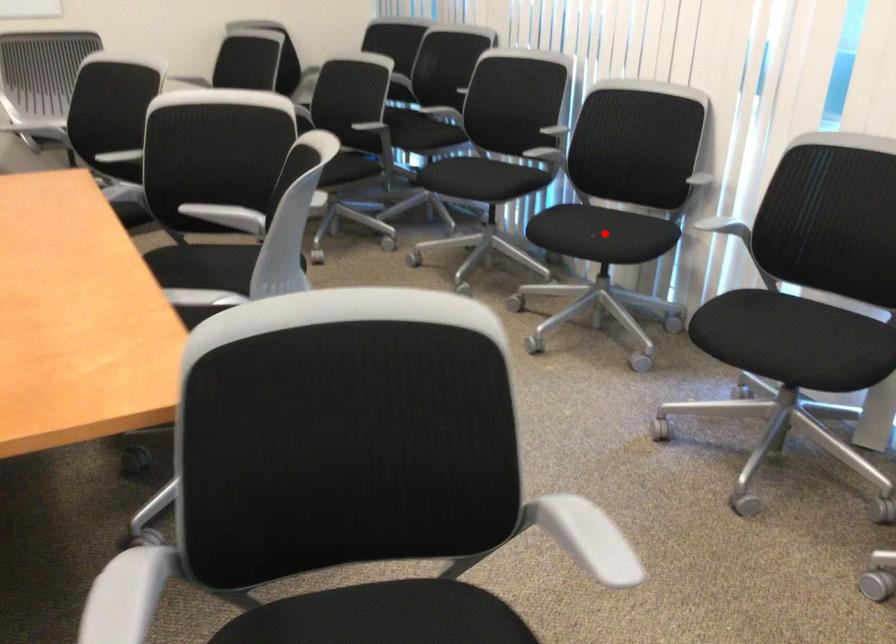
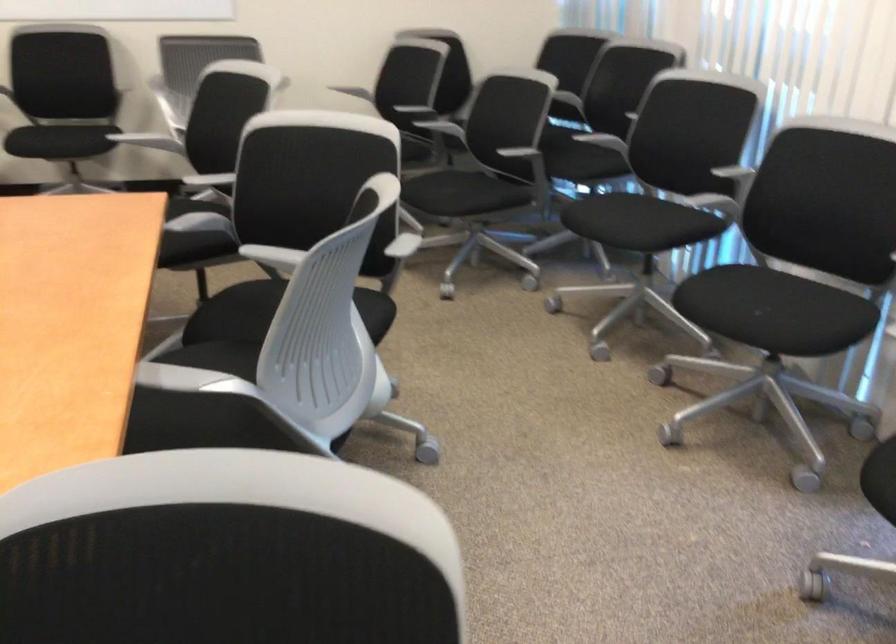
In the second image, find the point that corresponds to the highlighted location in the first image.

(771, 310)